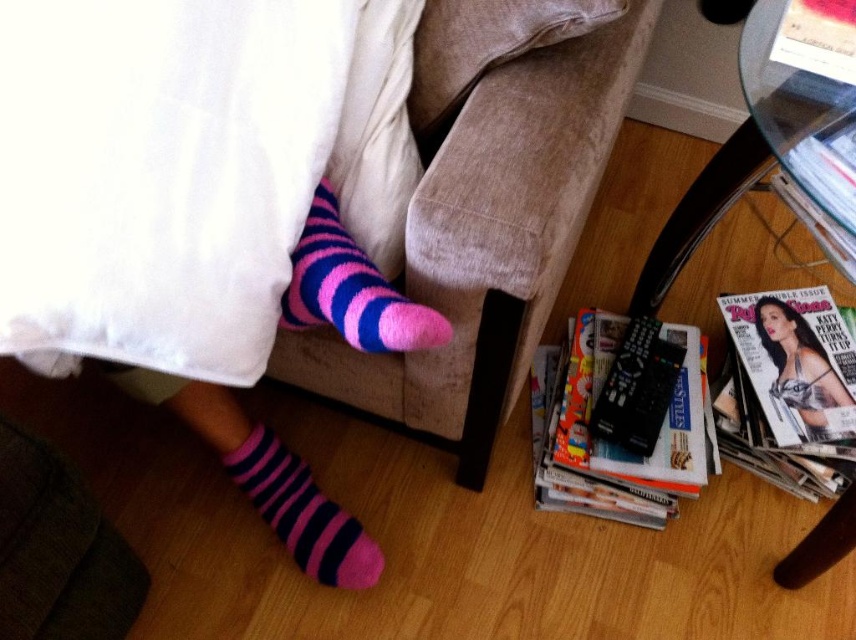
You are a robot trying to reach the matte black magazine at lower right from the pink fuzzy sock at center. Can you tell me which object is closer to the ground?

The matte black magazine at lower right is closer to the ground since the pink fuzzy sock at center is shorter than it.

You are trying to place the matte black magazine at lower right on top of the pink fuzzy sock at center. Considering their sizes, will the magazine fit entirely on the sock without hanging over the edges?

The pink fuzzy sock at center is wider than the matte black magazine at lower right, so the magazine should fit entirely on the sock without overhanging.